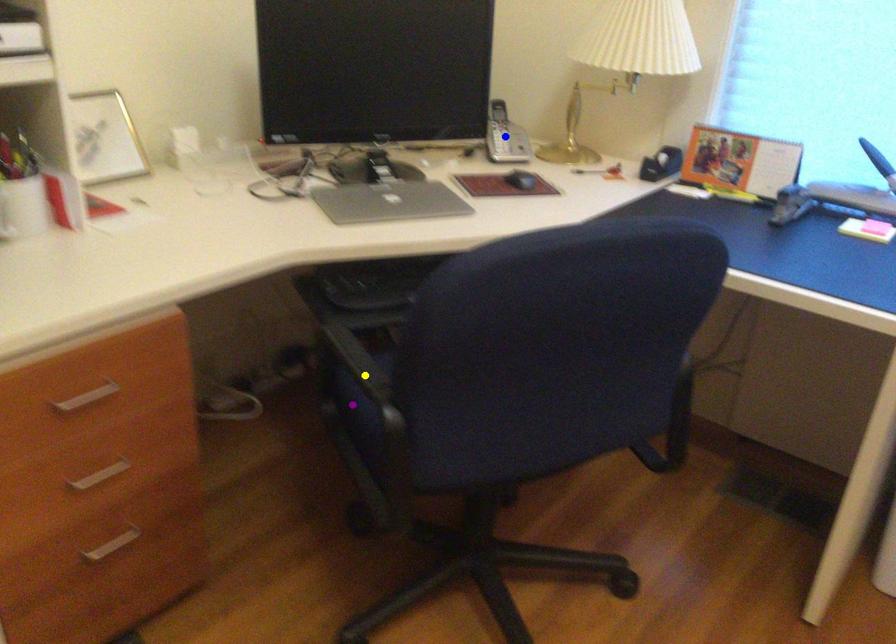
Looking at this image, order these from nearest to farthest:
1. blue point
2. yellow point
3. purple point

1. blue point
2. purple point
3. yellow point